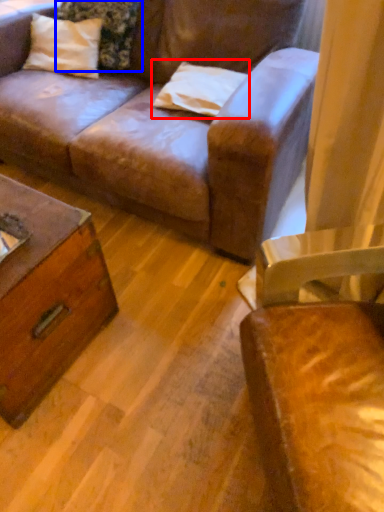
Question: Which point is further to the camera, pillow (highlighted by a red box) or pillow (highlighted by a blue box)?

Choices:
 (A) pillow
 (B) pillow

Answer: (B)